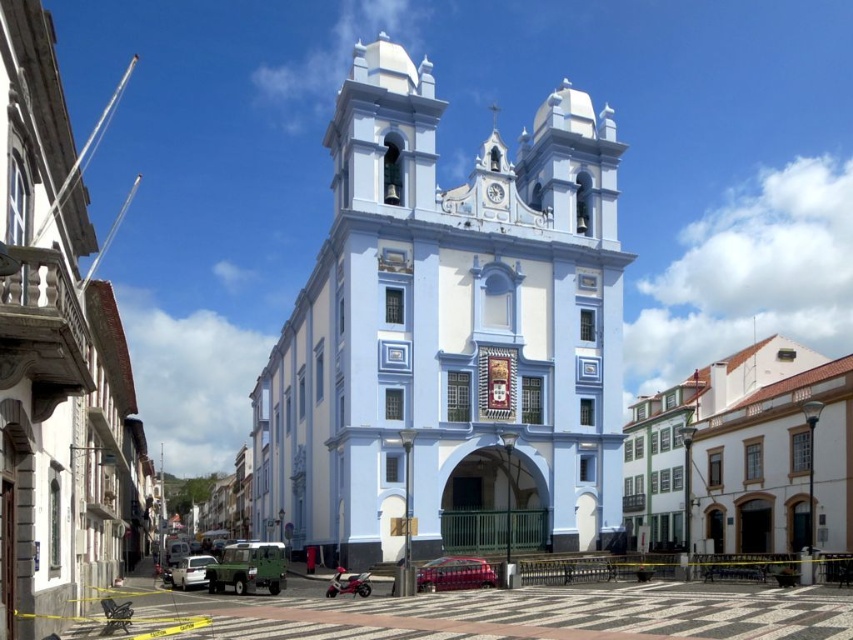
Question: Is light blue painted stone church at center in front of white matte car at lower left?

Choices:
 (A) yes
 (B) no

Answer: (A)

Question: Which of the following is the closest to the observer?

Choices:
 (A) green matte truck at center
 (B) metallic red car at center
 (C) white matte car at lower left

Answer: (B)

Question: In this image, where is light blue painted stone church at center located relative to metallic red car at center?

Choices:
 (A) below
 (B) above

Answer: (B)

Question: Is light blue painted stone church at center in front of green matte truck at center?

Choices:
 (A) no
 (B) yes

Answer: (B)

Question: Among these points, which one is farthest from the camera?

Choices:
 (A) (194, 556)
 (B) (215, 564)

Answer: (A)

Question: Among these objects, which one is farthest from the camera?

Choices:
 (A) metallic red car at center
 (B) green matte truck at center
 (C) light blue painted stone church at center

Answer: (B)